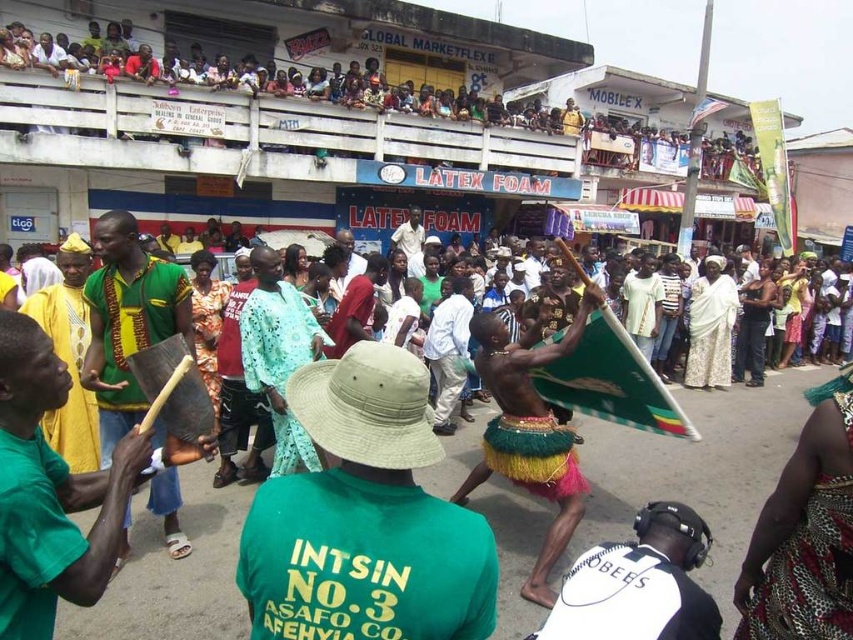
Question: Does multicolored fabric crowd at upper center have a greater width compared to white matte shirt at lower right?

Choices:
 (A) yes
 (B) no

Answer: (A)

Question: Can you confirm if multicolored fabric crowd at upper center is positioned to the right of white matte shirt at lower right?

Choices:
 (A) yes
 (B) no

Answer: (A)

Question: Which point appears closest to the camera in this image?

Choices:
 (A) (683, 557)
 (B) (680, 168)

Answer: (A)

Question: Can you confirm if green woven cloth at left is positioned to the left of white matte shirt at lower right?

Choices:
 (A) yes
 (B) no

Answer: (A)

Question: Which object is positioned closest to the white matte shirt at lower right?

Choices:
 (A) green woven cloth at left
 (B) multicolored fabric crowd at upper center

Answer: (A)

Question: Considering the real-world distances, which object is closest to the multicolored fabric crowd at upper center?

Choices:
 (A) green woven cloth at left
 (B) white matte shirt at lower right

Answer: (A)